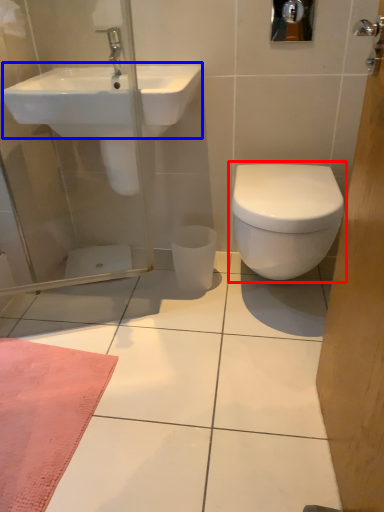
Question: Which point is closer to the camera, toilet (highlighted by a red box) or sink (highlighted by a blue box)?

Choices:
 (A) toilet
 (B) sink

Answer: (B)